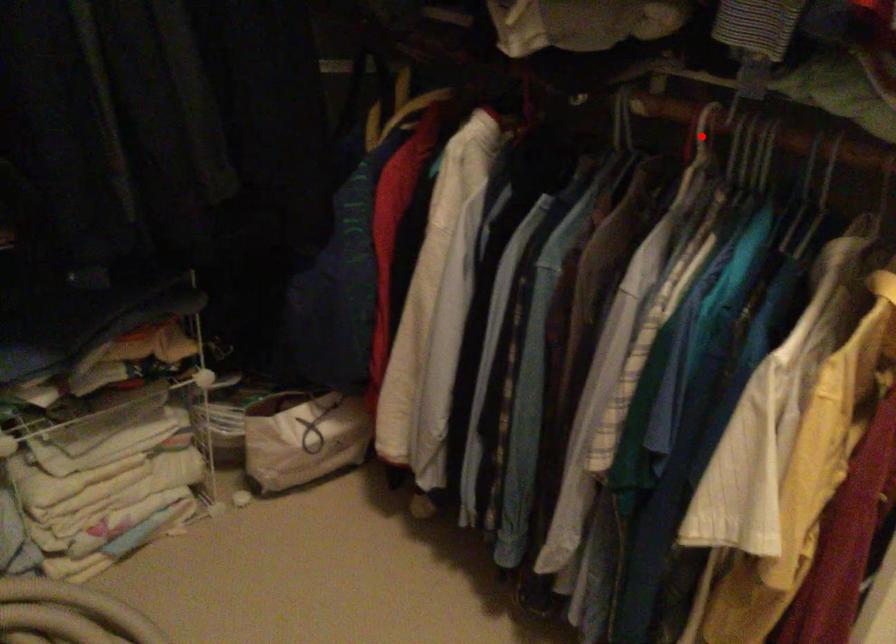
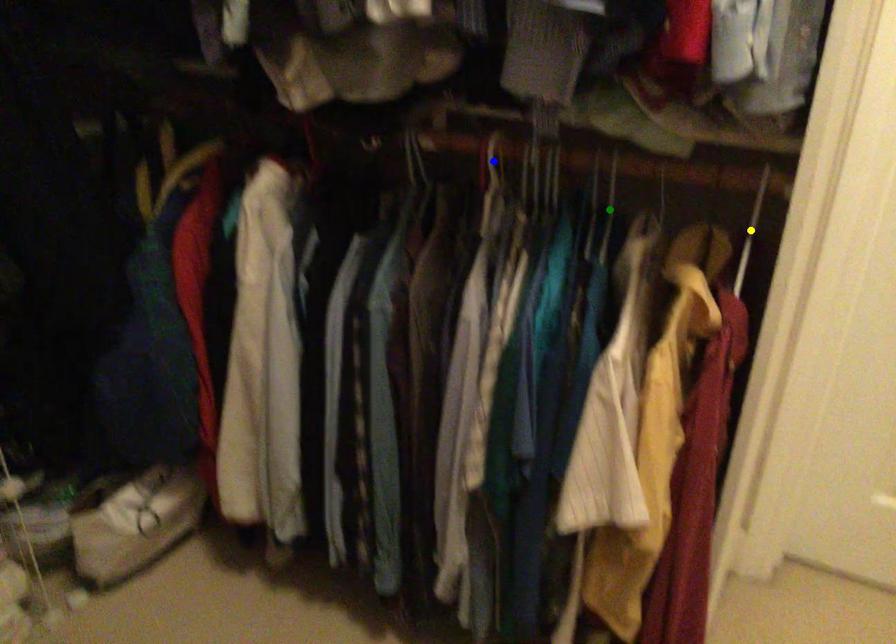
Question: I am providing you with two images of the same scene from different viewpoints. A red point is marked on the first image. You are given multiple points on the second image. Which point in image 2 is actually the same real-world point as the red point in image 1?

Choices:
 (A) yellow point
 (B) green point
 (C) blue point

Answer: (C)